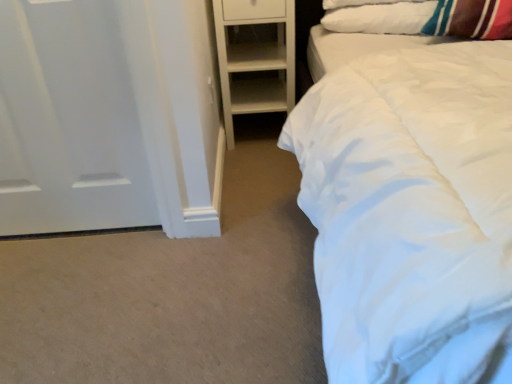
Where is `spots to the right of white matte door at left`? spots to the right of white matte door at left is located at coordinates (166, 253).